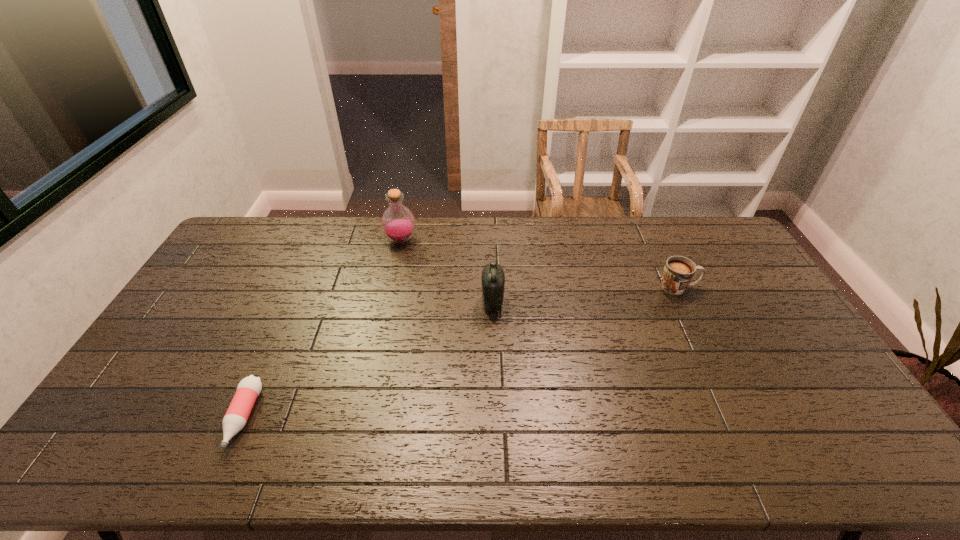
The width and height of the screenshot is (960, 540). In order to click on vacant area that lies between the second bottle from left to right and the third tallest object in this screenshot , I will do `click(540, 264)`.

The width and height of the screenshot is (960, 540). Identify the location of free space between the shortest bottle and the tallest bottle. (323, 329).

Identify the location of empty location between the third tallest object and the leftmost bottle. Image resolution: width=960 pixels, height=540 pixels. (461, 352).

Where is `vacant area between the second farthest bottle and the shortest object`? vacant area between the second farthest bottle and the shortest object is located at coordinates (368, 360).

Identify the location of empty location between the second shortest object and the nearest bottle. (461, 352).

Locate an element on the screen. free space that is in between the second shortest object and the nearest object is located at coordinates (461, 352).

In order to click on vacant region between the leftmost object and the third shortest object in this screenshot , I will do `click(368, 360)`.

Identify which object is located as the third nearest to the nearest bottle. Please provide its 2D coordinates. Your answer should be formatted as a tuple, i.e. [(x, y)], where the tuple contains the x and y coordinates of a point satisfying the conditions above.

[(678, 272)]

This screenshot has width=960, height=540. Identify the location of the second closest object to the second shortest object. (398, 223).

Select which bottle appears as the second closest to the second shortest object. Please provide its 2D coordinates. Your answer should be formatted as a tuple, i.e. [(x, y)], where the tuple contains the x and y coordinates of a point satisfying the conditions above.

[(398, 223)]